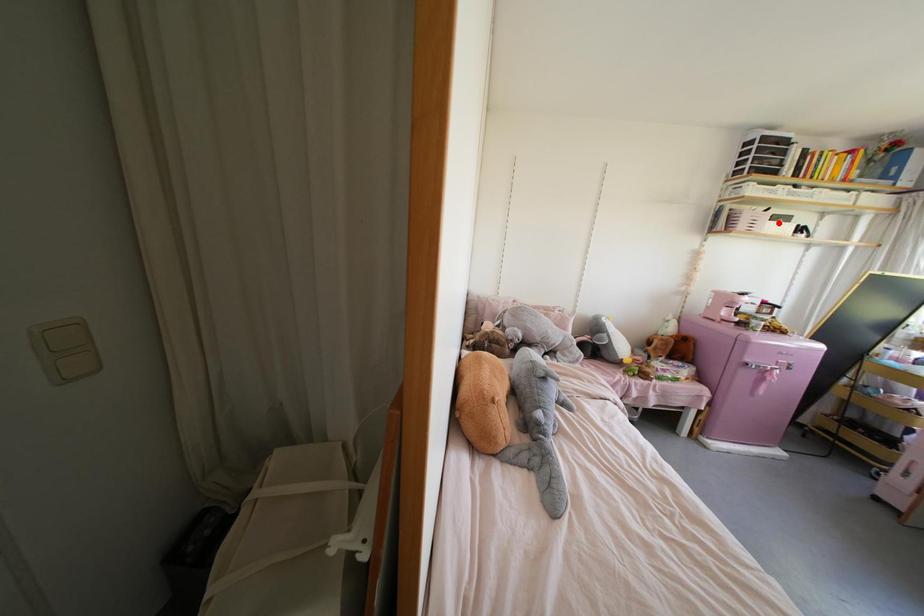
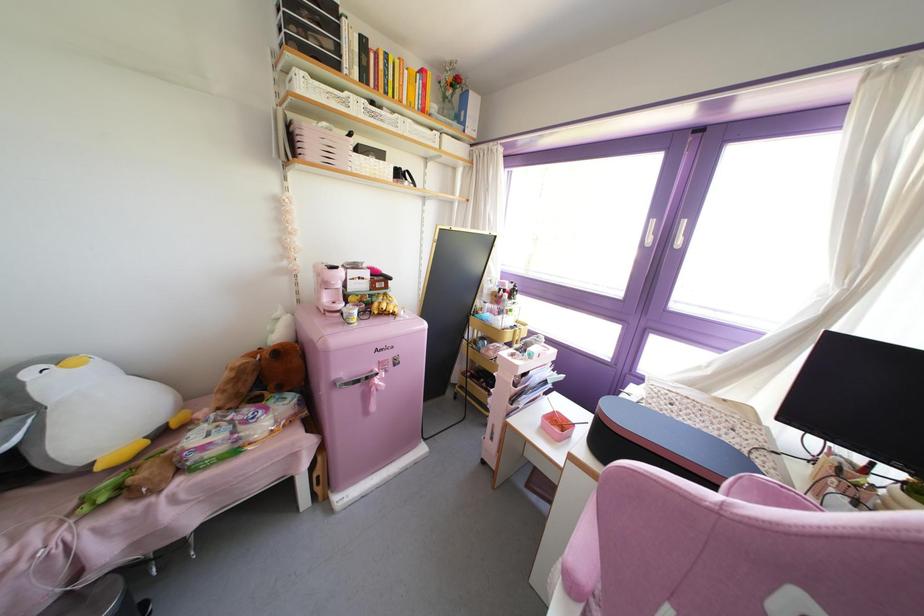
Find the pixel in the second image that matches the highlighted location in the first image.

(371, 160)